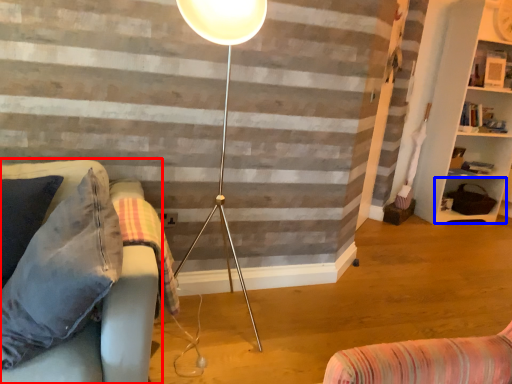
Question: Which object is closer to the camera taking this photo, studio couch (highlighted by a red box) or shelf (highlighted by a blue box)?

Choices:
 (A) studio couch
 (B) shelf

Answer: (A)